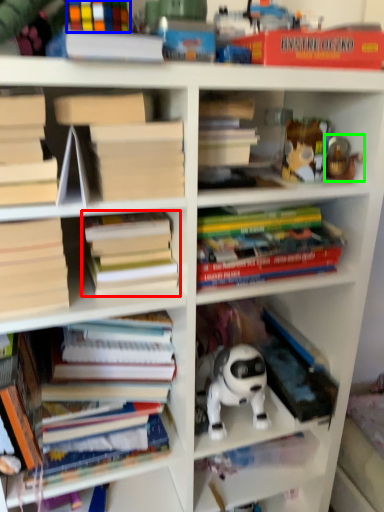
Question: Which is farther away from book (highlighted by a red box)? book (highlighted by a blue box) or toy (highlighted by a green box)?

Choices:
 (A) book
 (B) toy

Answer: (B)